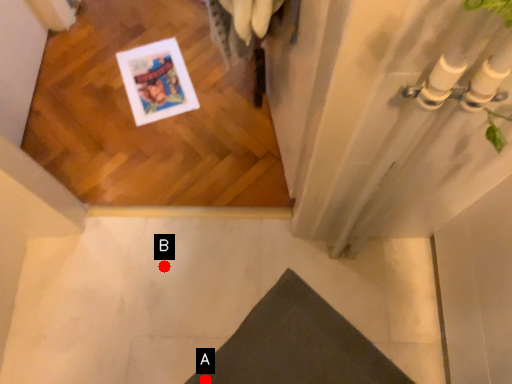
Question: Two points are circled on the image, labeled by A and B beside each circle. Which of the following is the closest to the observer?

Choices:
 (A) A is closer
 (B) B is closer

Answer: (A)